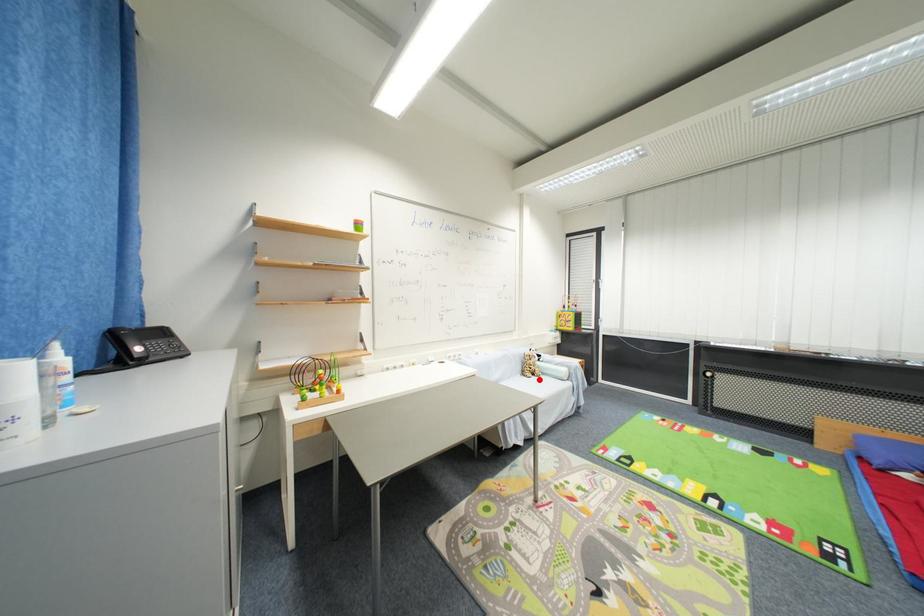
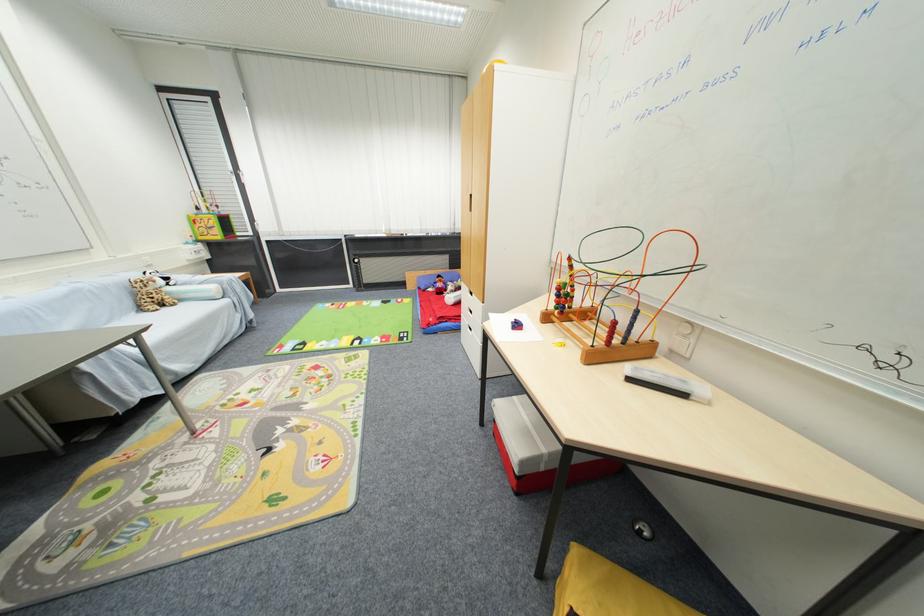
Find the pixel in the second image that matches the highlighted location in the first image.

(171, 310)